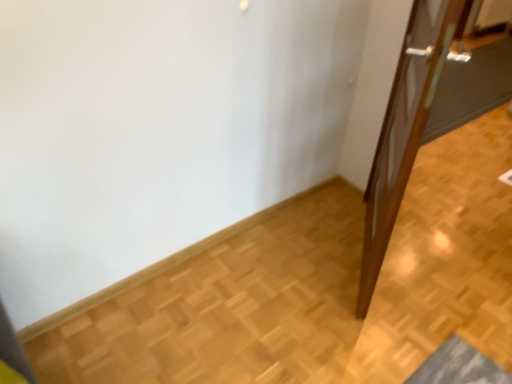
Identify the location of vacant space in front of matte brown door at right. tap(377, 353).